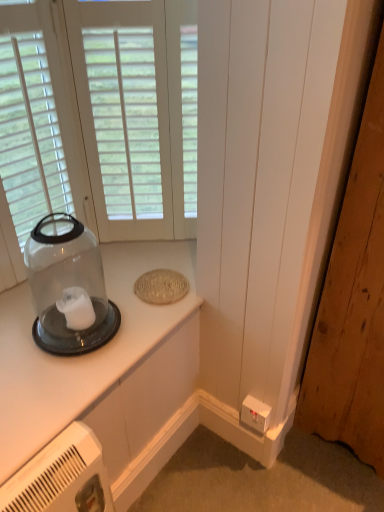
Question: Can you confirm if wooden door at lower right is thinner than clear glass jar at upper left?

Choices:
 (A) yes
 (B) no

Answer: (A)

Question: Is wooden door at lower right behind clear glass jar at upper left?

Choices:
 (A) yes
 (B) no

Answer: (B)

Question: From the image's perspective, is wooden door at lower right on clear glass jar at upper left?

Choices:
 (A) yes
 (B) no

Answer: (A)

Question: Is wooden door at lower right to the right of clear glass jar at upper left from the viewer's perspective?

Choices:
 (A) yes
 (B) no

Answer: (A)

Question: From the image's perspective, is wooden door at lower right under clear glass jar at upper left?

Choices:
 (A) no
 (B) yes

Answer: (A)

Question: From a real-world perspective, is wooden door at lower right positioned above or below clear glass jar at upper left?

Choices:
 (A) below
 (B) above

Answer: (B)

Question: In terms of height, does wooden door at lower right look taller or shorter compared to clear glass jar at upper left?

Choices:
 (A) short
 (B) tall

Answer: (B)

Question: From the image's perspective, is wooden door at lower right above or below clear glass jar at upper left?

Choices:
 (A) below
 (B) above

Answer: (B)

Question: Is wooden door at lower right bigger or smaller than clear glass jar at upper left?

Choices:
 (A) small
 (B) big

Answer: (B)

Question: Considering the positions of transparent glass jar at left and wooden door at lower right in the image, is transparent glass jar at left taller or shorter than wooden door at lower right?

Choices:
 (A) tall
 (B) short

Answer: (B)

Question: Based on their positions, is transparent glass jar at left located to the left or right of wooden door at lower right?

Choices:
 (A) right
 (B) left

Answer: (B)

Question: Considering their positions, is transparent glass jar at left located in front of or behind wooden door at lower right?

Choices:
 (A) behind
 (B) front

Answer: (A)

Question: Considering the positions of point (36, 301) and point (317, 331), is point (36, 301) closer or farther from the camera than point (317, 331)?

Choices:
 (A) closer
 (B) farther

Answer: (A)

Question: Considering the positions of point (49, 200) and point (69, 279), is point (49, 200) closer or farther from the camera than point (69, 279)?

Choices:
 (A) closer
 (B) farther

Answer: (A)

Question: Is white wood window at upper left bigger or smaller than transparent glass jar at left?

Choices:
 (A) small
 (B) big

Answer: (A)